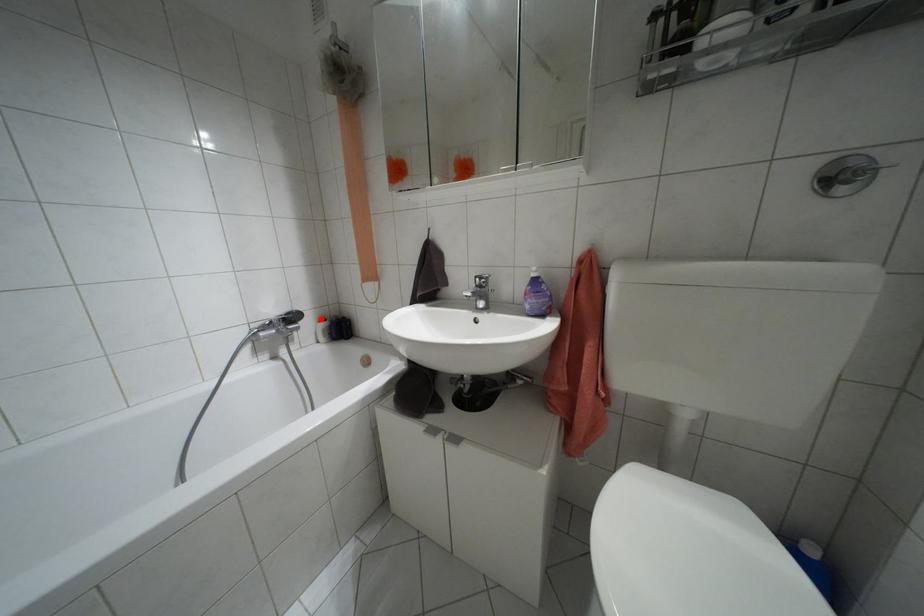
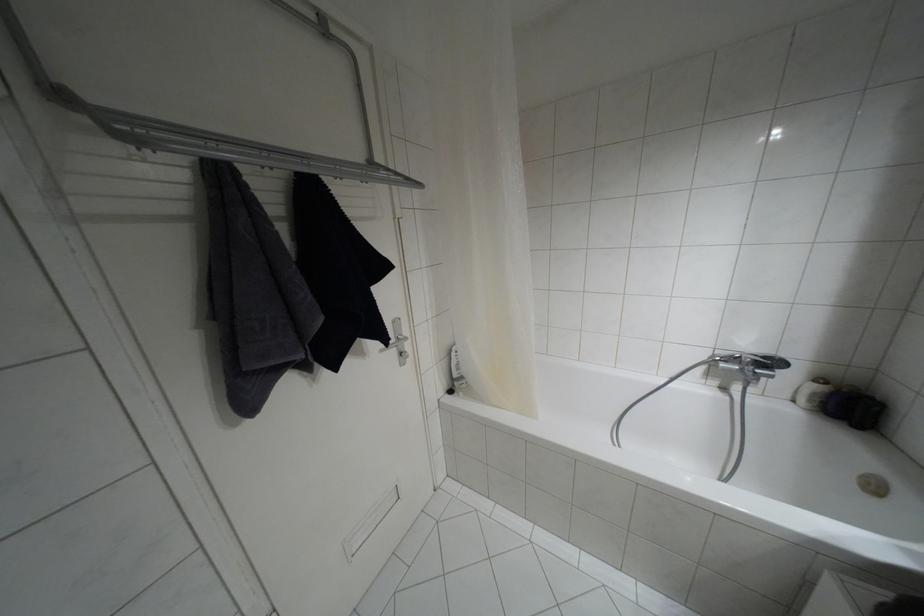
In the second image, find the point that corresponds to the highlighted location in the first image.

(820, 379)